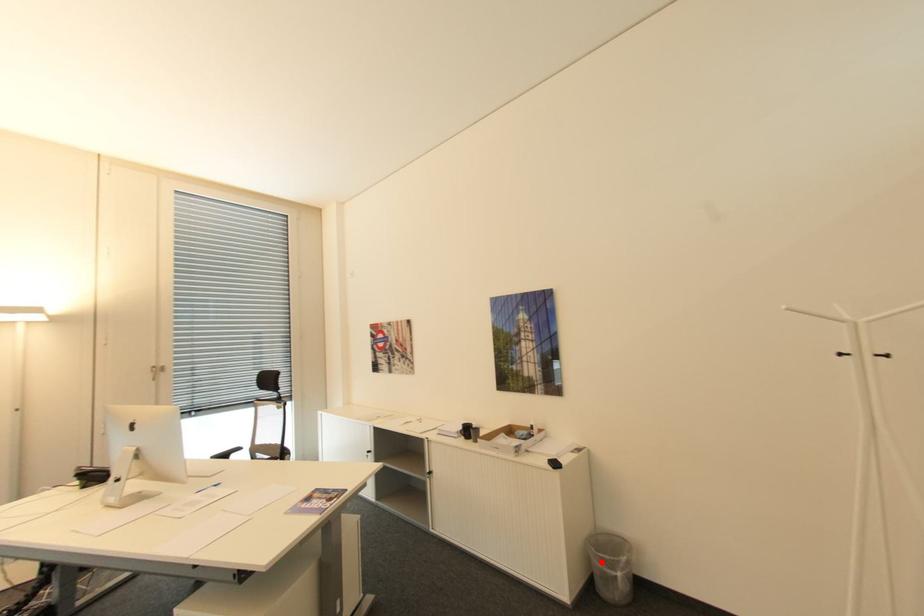
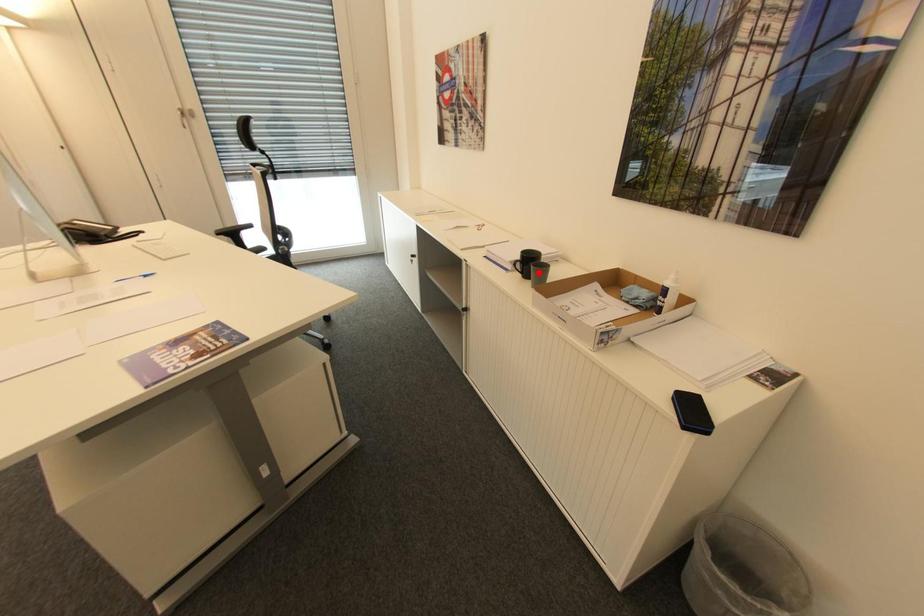
I am providing you with two images of the same scene from different viewpoints. A red point is marked on the first image and another point is marked on the second image. Does the point marked in image1 correspond to the same location as the one in image2?

No